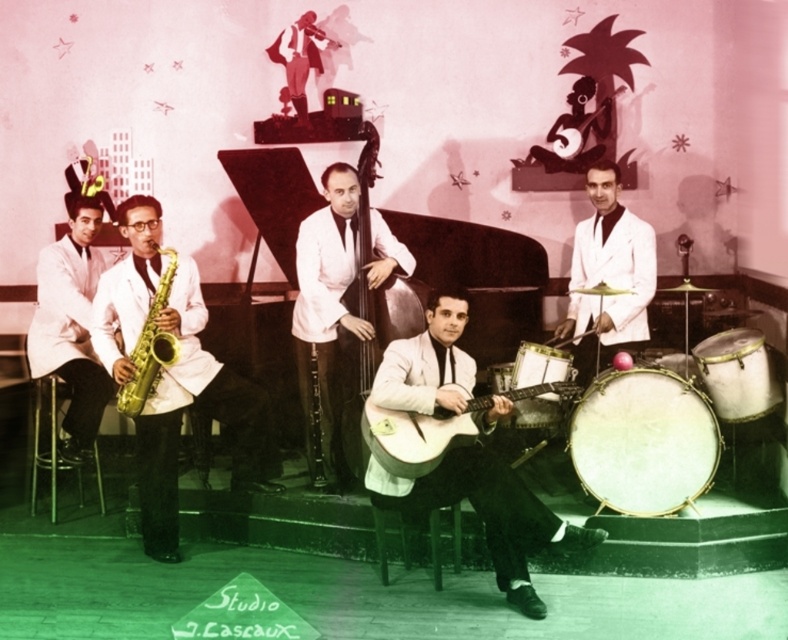
Based on the scene description, where is the light brown wooden guitar at center located in terms of coordinates?

The light brown wooden guitar at center is located at point coordinates of (419,433).

You are a stagehand setting up the band equipment. You need to place a music stand between the light brown wooden guitar at center and the white drum at center. Since the guitar is taller, where should you position the stand to avoid blocking the drummer?

The light brown wooden guitar at center is taller than the white drum at center. To avoid blocking the drummer, position the music stand closer to the guitar side, so the stand is between the guitar and the drummer, utilizing the guitar as a natural barrier.